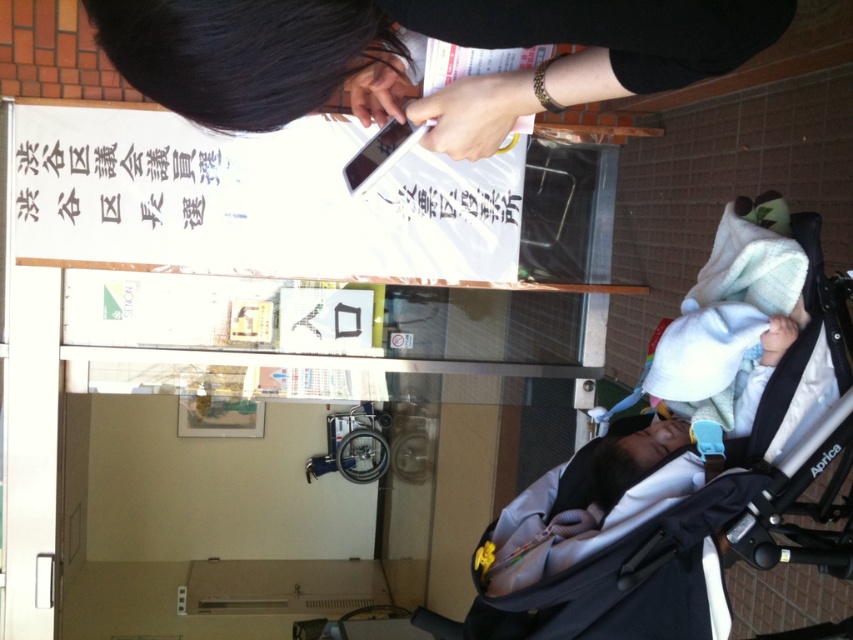
Does black fabric baby carriage at lower right appear over black matte phone at upper center?

→ Incorrect, black fabric baby carriage at lower right is not positioned above black matte phone at upper center.

Looking at this image, between black fabric baby carriage at lower right and black matte phone at upper center, which one is positioned higher?

black matte phone at upper center is above.

Is point (733, 202) less distant than point (380, 42)?

No, (733, 202) is further to viewer.

What are the coordinates of `black fabric baby carriage at lower right` in the screenshot? It's located at (683, 456).